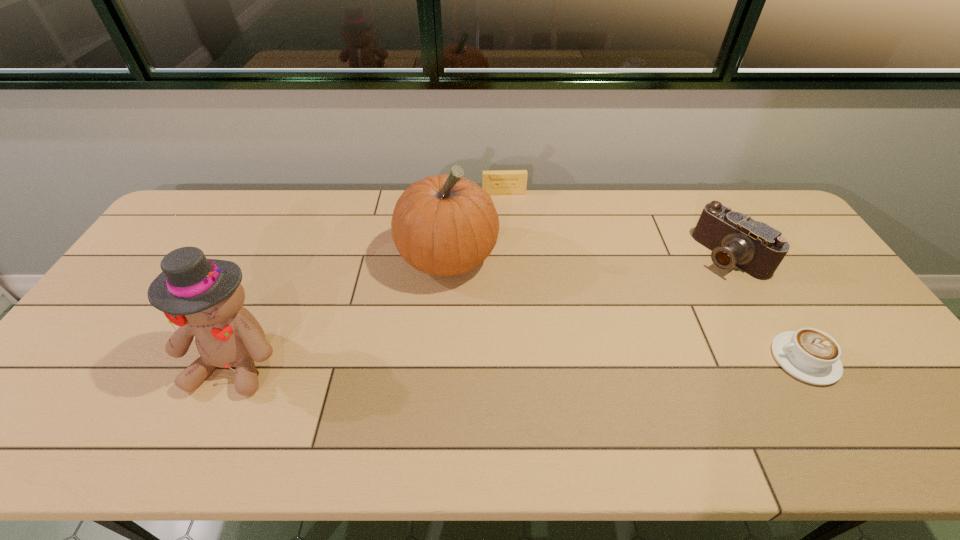
This screenshot has width=960, height=540. In order to click on camera present at the far edge in this screenshot , I will do `click(735, 239)`.

Identify the location of rag_doll at the near edge. (204, 297).

Identify the location of cappuccino located at the near edge. (810, 355).

You are a GUI agent. You are given a task and a screenshot of the screen. Output one action in this format:
    pyautogui.click(x=<x>, y=<y>)
    Task: Click on the object at the right edge
    This screenshot has height=540, width=960.
    Given the screenshot: What is the action you would take?
    pyautogui.click(x=810, y=355)

You are a GUI agent. You are given a task and a screenshot of the screen. Output one action in this format:
    pyautogui.click(x=<x>, y=<y>)
    Task: Click on the object present at the near right corner
    This screenshot has width=960, height=540.
    Given the screenshot: What is the action you would take?
    pyautogui.click(x=810, y=355)

You are a GUI agent. You are given a task and a screenshot of the screen. Output one action in this format:
    pyautogui.click(x=<x>, y=<y>)
    Task: Click on the vacant position at the near edge of the desktop
    This screenshot has height=540, width=960.
    Given the screenshot: What is the action you would take?
    pyautogui.click(x=474, y=387)

The width and height of the screenshot is (960, 540). In the image, there is a desktop. Identify the location of vacant space at the right edge. (825, 269).

The width and height of the screenshot is (960, 540). I want to click on unoccupied position between the leftmost object and the videotape, so click(371, 276).

At what (x,y) coordinates should I click in order to perform the action: click on empty space between the pumpkin and the cappuccino. Please return your answer as a coordinate pair (x, y). The height and width of the screenshot is (540, 960). Looking at the image, I should click on (626, 308).

Image resolution: width=960 pixels, height=540 pixels. I want to click on vacant point located between the fourth tallest object and the rag_doll, so click(371, 276).